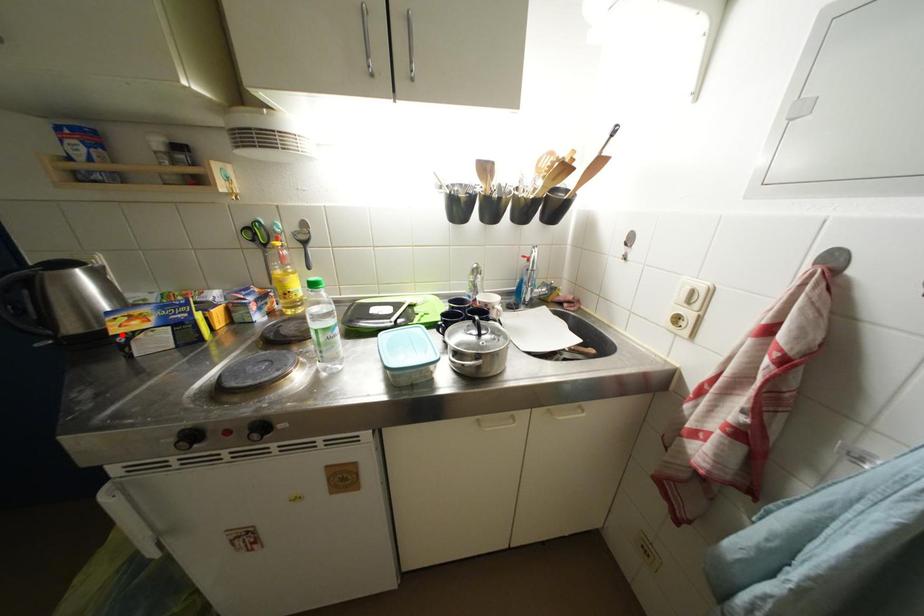
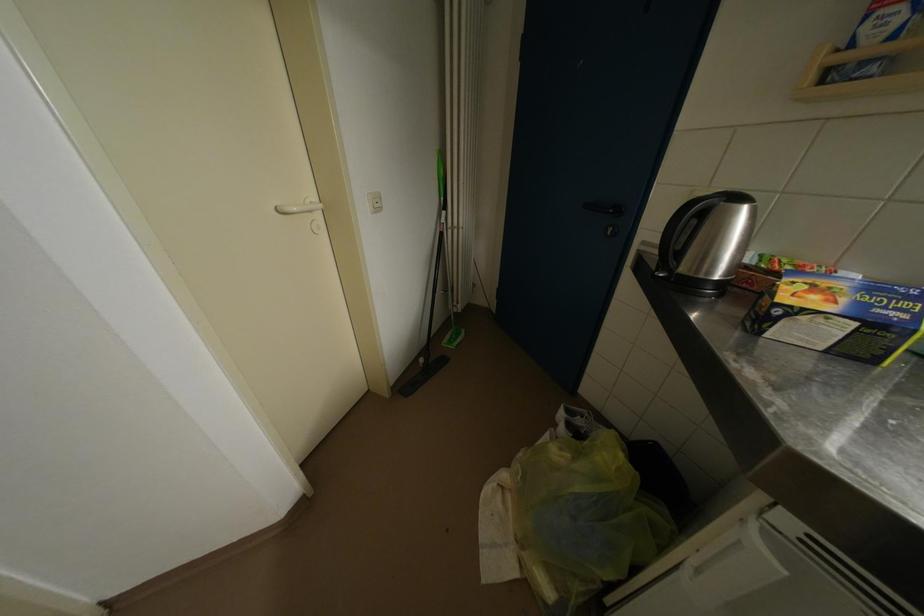
Where in the second image is the point corresponding to the highlighted location from the first image?

(791, 302)